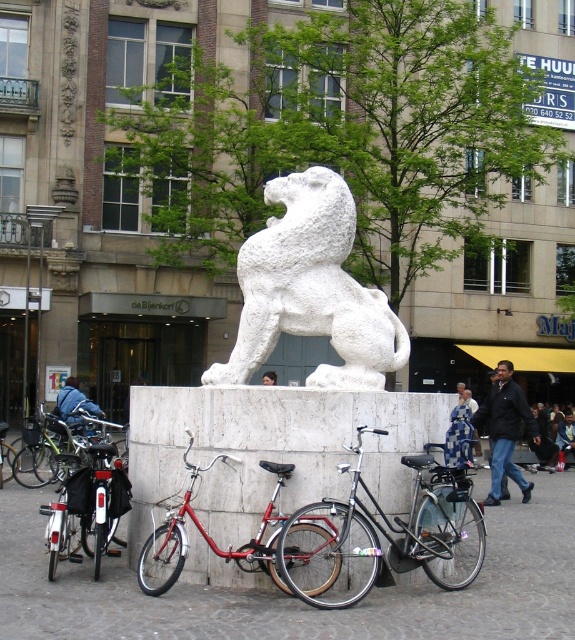
You are a cyclist who wants to retrieve your shiny black bicycle at center from behind the white stone lion at center. Can you easily access it without moving the lion?

The shiny black bicycle at center is behind the white stone lion at center, so you can easily access it by walking around the pedestal to the back side where the bicycle is parked, without needing to move the lion.

You are a city planner assessing the public square. You need to ensure that the white stone lion at center and the shiny black bicycle at center comply with the city ordinance that requires all monuments to be taller than any nearby objects. Does the current arrangement meet this requirement?

The white stone lion at center has a lesser height compared to the shiny black bicycle at center, so the current arrangement does not meet the city ordinance requirement since the monument is shorter than the nearby object.